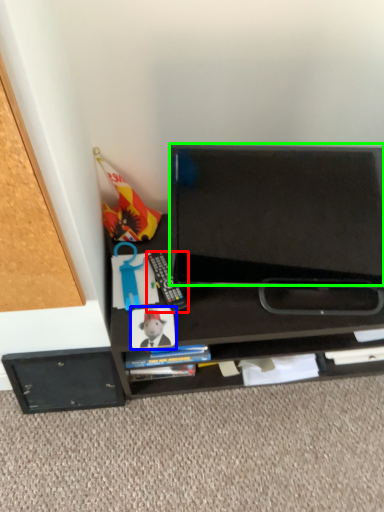
Question: Which object is the farthest from equipment (highlighted by a red box)? Choose among these: paperback book (highlighted by a blue box) or back (highlighted by a green box).

Choices:
 (A) paperback book
 (B) back

Answer: (B)